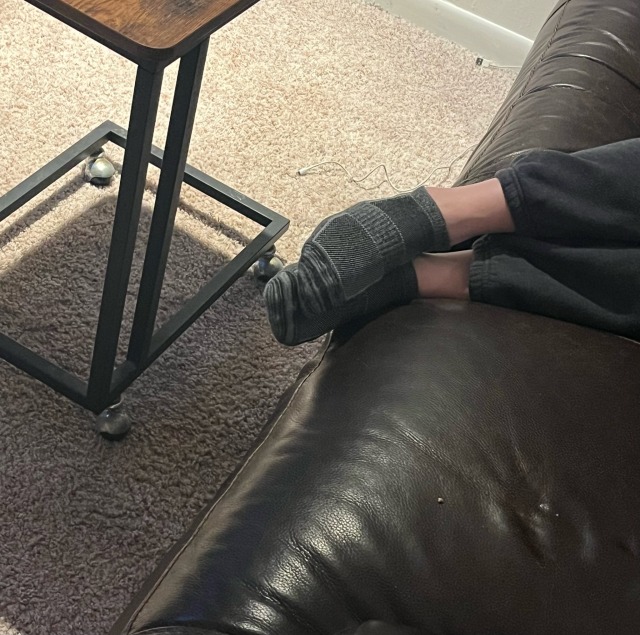
I want to click on carpet, so click(249, 148).